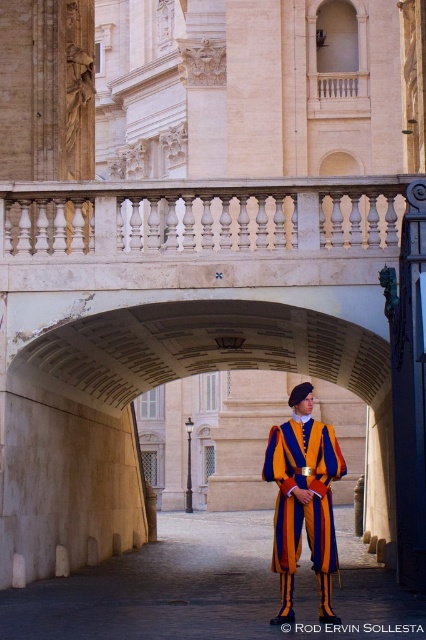
Question: Can you confirm if white marble balustrade at upper center is wider than orange-yellow striped uniform at center?

Choices:
 (A) no
 (B) yes

Answer: (B)

Question: Does white marble balustrade at upper center appear under orange-yellow striped uniform at center?

Choices:
 (A) no
 (B) yes

Answer: (A)

Question: Is white marble balustrade at upper center further to the viewer compared to orange-yellow striped uniform at center?

Choices:
 (A) yes
 (B) no

Answer: (A)

Question: Which point is closer to the camera?

Choices:
 (A) white marble balustrade at upper center
 (B) orange-yellow striped uniform at center

Answer: (B)

Question: Which object appears farthest from the camera in this image?

Choices:
 (A) orange-yellow striped uniform at center
 (B) white marble balustrade at upper center

Answer: (B)